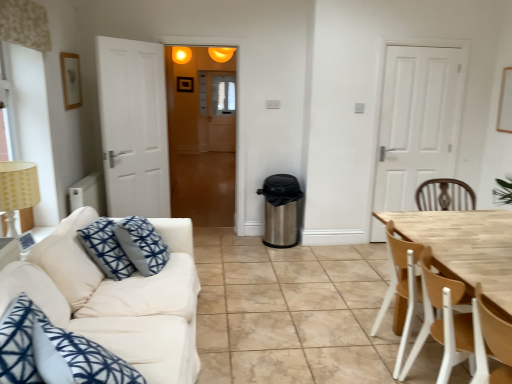
Question: Does light brown wood chair at right, the second chair from the back, have a smaller size compared to white fabric couch at left?

Choices:
 (A) yes
 (B) no

Answer: (A)

Question: Does light brown wood chair at right, the second chair from the back, come in front of white fabric couch at left?

Choices:
 (A) no
 (B) yes

Answer: (A)

Question: Is light brown wood chair at right, the second chair from the back, to the right of white fabric couch at left from the viewer's perspective?

Choices:
 (A) no
 (B) yes

Answer: (B)

Question: Is light brown wood chair at right, the second chair from the back, taller than white fabric couch at left?

Choices:
 (A) yes
 (B) no

Answer: (B)

Question: Is light brown wood chair at right, which is counted as the 1th chair, starting from the front, aimed at white fabric couch at left?

Choices:
 (A) no
 (B) yes

Answer: (A)

Question: Relative to translucent wooden door at center, is matte orange light fixture at upper center in front or behind?

Choices:
 (A) front
 (B) behind

Answer: (B)

Question: Is matte orange light fixture at upper center taller or shorter than translucent wooden door at center?

Choices:
 (A) short
 (B) tall

Answer: (A)

Question: Is point (190, 56) positioned closer to the camera than point (219, 165)?

Choices:
 (A) closer
 (B) farther

Answer: (A)

Question: From a real-world perspective, is matte orange light fixture at upper center above or below translucent wooden door at center?

Choices:
 (A) below
 (B) above

Answer: (B)

Question: From a real-world perspective, relative to light brown wood chair at right, which is counted as the 1th chair, starting from the front, is matte orange light fixture at upper center vertically above or below?

Choices:
 (A) below
 (B) above

Answer: (B)

Question: From the image's perspective, is matte orange light fixture at upper center above or below light brown wood chair at right, which is counted as the 1th chair, starting from the front?

Choices:
 (A) above
 (B) below

Answer: (A)

Question: Considering the positions of matte orange light fixture at upper center and light brown wood chair at right, the second chair from the back, in the image, is matte orange light fixture at upper center taller or shorter than light brown wood chair at right, the second chair from the back,?

Choices:
 (A) short
 (B) tall

Answer: (A)

Question: In the image, is matte orange light fixture at upper center positioned in front of or behind light brown wood chair at right, which is counted as the 1th chair, starting from the front?

Choices:
 (A) behind
 (B) front

Answer: (A)

Question: Is point (30, 165) positioned closer to the camera than point (442, 283)?

Choices:
 (A) closer
 (B) farther

Answer: (B)

Question: In terms of width, does beige fabric lampshade at left look wider or thinner when compared to light brown wood chair at right, the second chair from the back?

Choices:
 (A) thin
 (B) wide

Answer: (A)